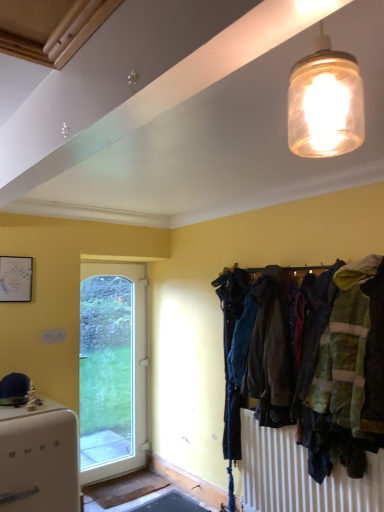
Question: Are dark blue fabric coat at center right and white matte refrigerator at lower left located far from each other?

Choices:
 (A) yes
 (B) no

Answer: (A)

Question: Considering the relative positions of dark blue fabric coat at center right and white matte refrigerator at lower left in the image provided, is dark blue fabric coat at center right behind white matte refrigerator at lower left?

Choices:
 (A) no
 (B) yes

Answer: (B)

Question: Is dark blue fabric coat at center right at the right side of white matte refrigerator at lower left?

Choices:
 (A) yes
 (B) no

Answer: (A)

Question: Would you say dark blue fabric coat at center right is outside white matte refrigerator at lower left?

Choices:
 (A) yes
 (B) no

Answer: (A)

Question: Would you say white matte refrigerator at lower left is part of dark blue fabric coat at center right's contents?

Choices:
 (A) no
 (B) yes

Answer: (A)

Question: Based on their positions, is dark blue fabric coat at center right located to the left or right of translucent glass jar at upper center?

Choices:
 (A) right
 (B) left

Answer: (A)

Question: Do you think dark blue fabric coat at center right is within translucent glass jar at upper center, or outside of it?

Choices:
 (A) inside
 (B) outside

Answer: (B)

Question: Is dark blue fabric coat at center right in front of or behind translucent glass jar at upper center in the image?

Choices:
 (A) front
 (B) behind

Answer: (B)

Question: Based on their sizes in the image, would you say dark blue fabric coat at center right is bigger or smaller than translucent glass jar at upper center?

Choices:
 (A) small
 (B) big

Answer: (B)

Question: Is translucent glass jar at upper center situated inside white matte refrigerator at lower left or outside?

Choices:
 (A) outside
 (B) inside

Answer: (A)

Question: Considering the positions of translucent glass jar at upper center and white matte refrigerator at lower left in the image, is translucent glass jar at upper center taller or shorter than white matte refrigerator at lower left?

Choices:
 (A) tall
 (B) short

Answer: (B)

Question: From a real-world perspective, relative to white matte refrigerator at lower left, is translucent glass jar at upper center vertically above or below?

Choices:
 (A) above
 (B) below

Answer: (A)

Question: Is point (355, 146) positioned closer to the camera than point (29, 470)?

Choices:
 (A) closer
 (B) farther

Answer: (A)

Question: Is dark blue fabric coat at center right spatially inside white matte refrigerator at lower left, or outside of it?

Choices:
 (A) inside
 (B) outside

Answer: (B)

Question: From a real-world perspective, relative to white matte refrigerator at lower left, is dark blue fabric coat at center right vertically above or below?

Choices:
 (A) below
 (B) above

Answer: (B)